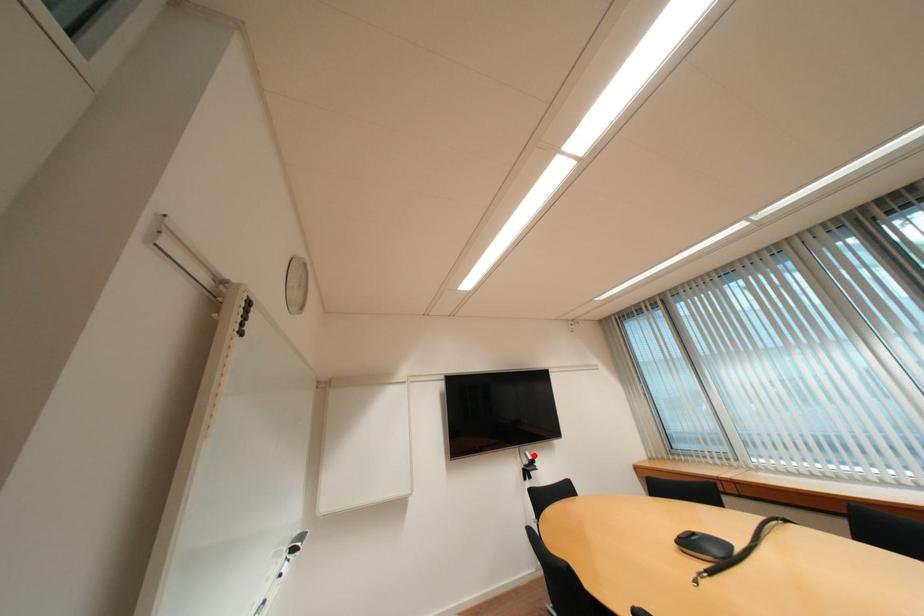
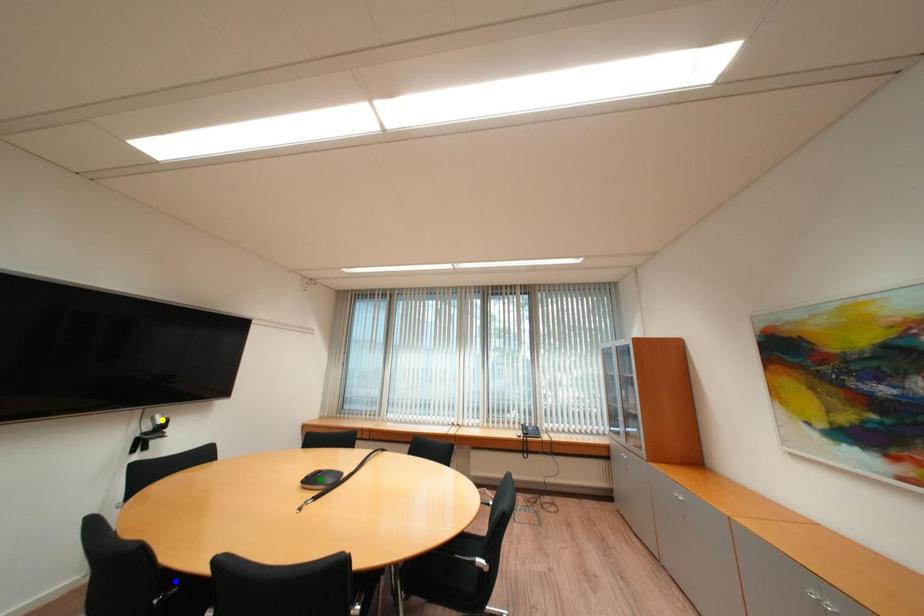
Question: I am providing you with two images of the same scene from different viewpoints. A red point is marked on the first image. You are given multiple points on the second image. Which point in image 2 is actually the same real-world point as the red point in image 1?

Choices:
 (A) yellow point
 (B) blue point
 (C) green point

Answer: (A)